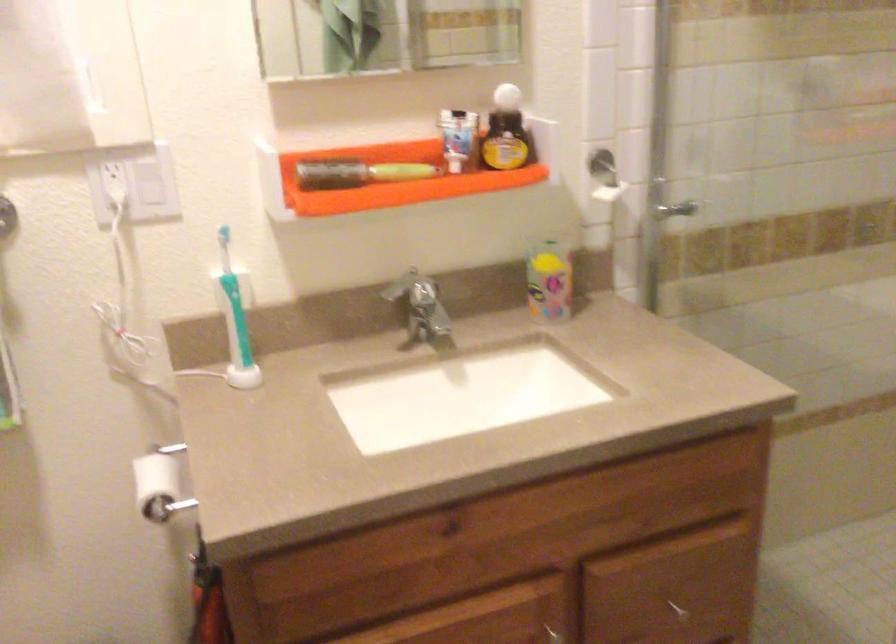
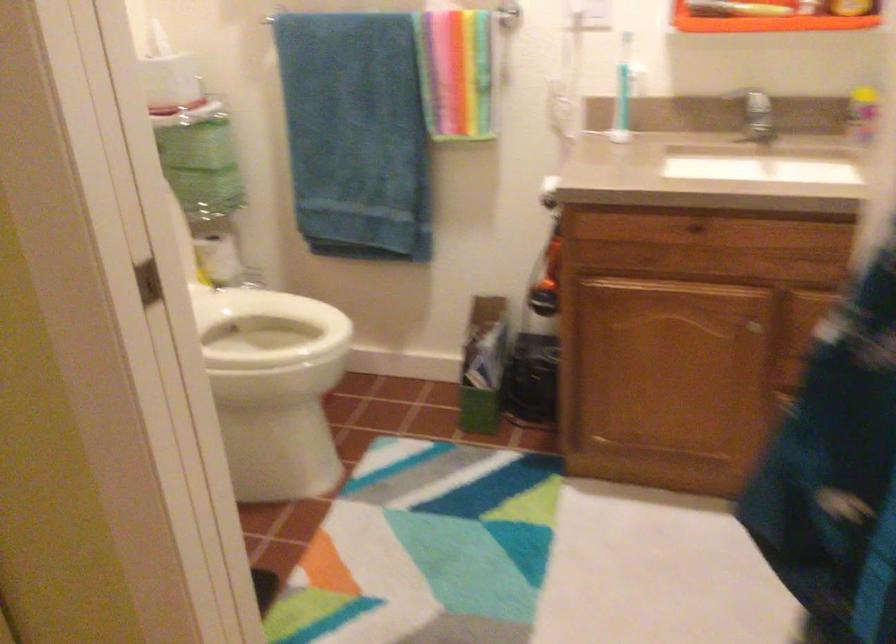
In the second image, find the point that corresponds to point (434, 532) in the first image.

(692, 229)